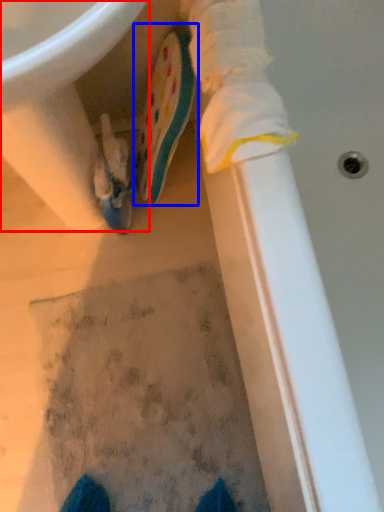
Question: Which point is further to the camera, sink (highlighted by a red box) or footwear (highlighted by a blue box)?

Choices:
 (A) sink
 (B) footwear

Answer: (B)